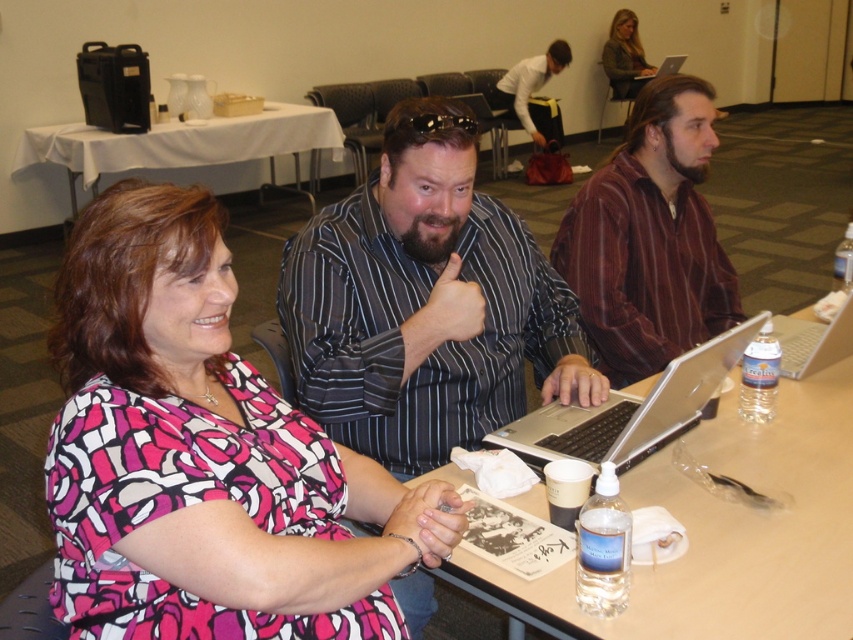
Question: Among these points, which one is farthest from the camera?

Choices:
 (A) (718, 326)
 (B) (822, 588)
 (C) (622, 403)

Answer: (A)

Question: Does wooden table at center have a lesser width compared to silver metallic laptop at right?

Choices:
 (A) yes
 (B) no

Answer: (B)

Question: Which of the following is the farthest from the observer?

Choices:
 (A) pos(624,33)
 (B) pos(97,170)
 (C) pos(546,436)

Answer: (A)

Question: Which object appears closest to the camera in this image?

Choices:
 (A) white cloth-covered table at upper left
 (B) silver metallic laptop at center

Answer: (B)

Question: Is pink printed blouse at center thinner than silver metallic laptop at upper right?

Choices:
 (A) yes
 (B) no

Answer: (A)

Question: Observing the image, what is the correct spatial positioning of brown striped shirt at center in reference to silver metallic laptop at upper right?

Choices:
 (A) right
 (B) left

Answer: (B)